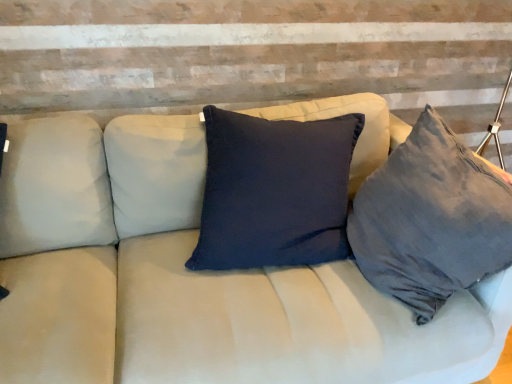
You are a GUI agent. You are given a task and a screenshot of the screen. Output one action in this format:
    pyautogui.click(x=<x>, y=<y>)
    Task: Click on the dark gray fabric pillow at right
    
    Given the screenshot: What is the action you would take?
    pyautogui.click(x=430, y=220)

What do you see at coordinates (430, 220) in the screenshot?
I see `dark gray fabric pillow at right` at bounding box center [430, 220].

Measure the distance between dark gray fabric pillow at right and camera.

They are 1.08 meters apart.

You are a GUI agent. You are given a task and a screenshot of the screen. Output one action in this format:
    pyautogui.click(x=<x>, y=<y>)
    Task: Click on the dark gray fabric pillow at right
    
    Given the screenshot: What is the action you would take?
    pyautogui.click(x=430, y=220)